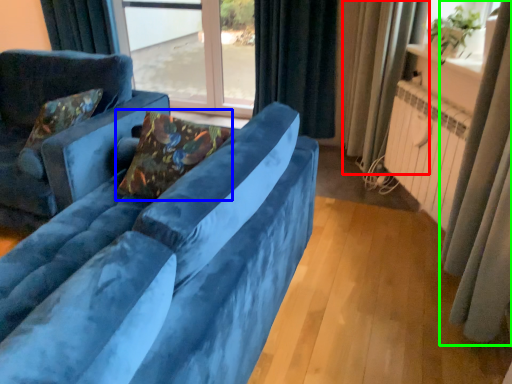
Question: Which object is positioned farthest from curtain (highlighted by a red box)? Select from pillow (highlighted by a blue box) and curtain (highlighted by a green box).

Choices:
 (A) pillow
 (B) curtain

Answer: (A)